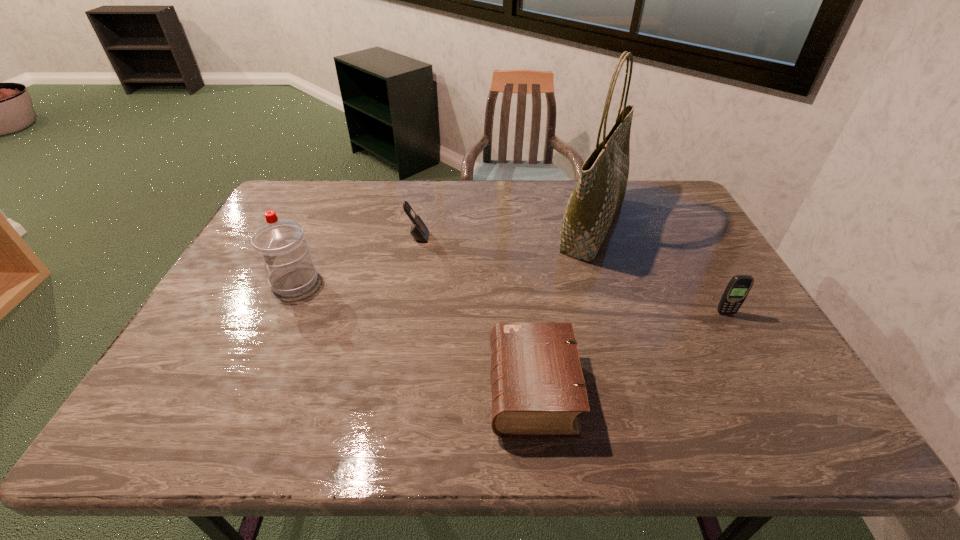
Locate an element on the screen. shopping bag is located at coordinates 600,191.

Find the location of `the second object from right to left`. the second object from right to left is located at coordinates (600, 191).

Locate an element on the screen. the leftmost object is located at coordinates (281, 243).

This screenshot has width=960, height=540. What are the coordinates of `the fourth shortest object` in the screenshot? It's located at (281, 243).

Identify the location of the farther cellular telephone. The height and width of the screenshot is (540, 960). (419, 231).

Find the location of a particular element. The width and height of the screenshot is (960, 540). the left cellular telephone is located at coordinates pyautogui.click(x=419, y=231).

At what (x,y) coordinates should I click in order to perform the action: click on the right cellular telephone. Please return your answer as a coordinate pair (x, y). Image resolution: width=960 pixels, height=540 pixels. Looking at the image, I should click on (739, 286).

I want to click on the rightmost object, so click(739, 286).

Where is `the shortest object`? the shortest object is located at coordinates (538, 390).

This screenshot has height=540, width=960. In order to click on Bible in this screenshot , I will do `click(538, 390)`.